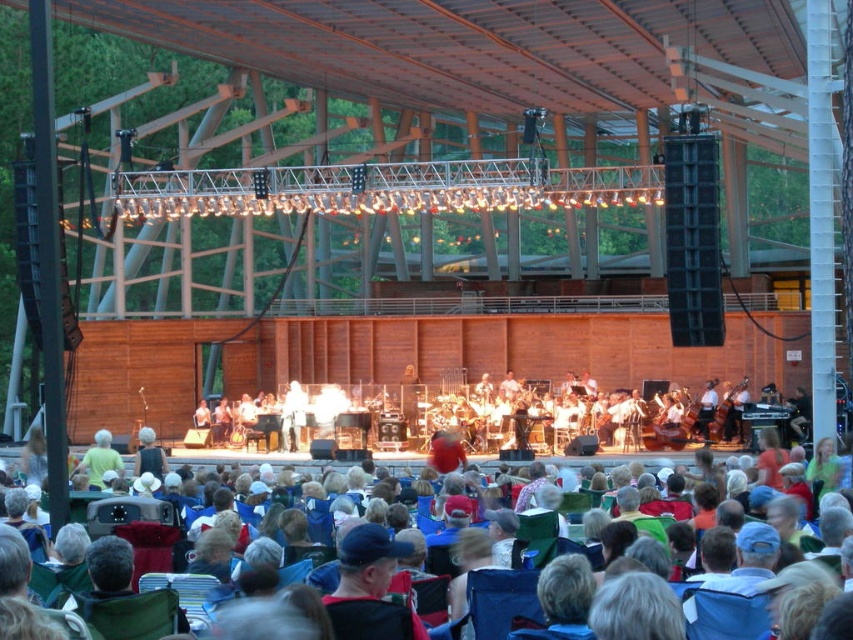
You are attending an outdoor concert under the pavilion and want to sit as close as possible to the stage. The stage is located at the front of the pavilion. Are the blue fabric chairs at center the best option for sitting closest to the stage?

The blue fabric chairs at center are located at point (724, 614), which is closer to the stage than other seating areas. Therefore, the blue fabric chairs at center are the best option for sitting closest to the stage.

You are sitting in the audience at the outdoor concert and want to move from your seat to the stage. There are blue fabric chairs at center and light green fabric at center in your path. Which object should you go around to reach the stage more quickly?

You should go around the blue fabric chairs at center because it is closer to you, so moving around it would be faster than going around the light green fabric at center which is further away.